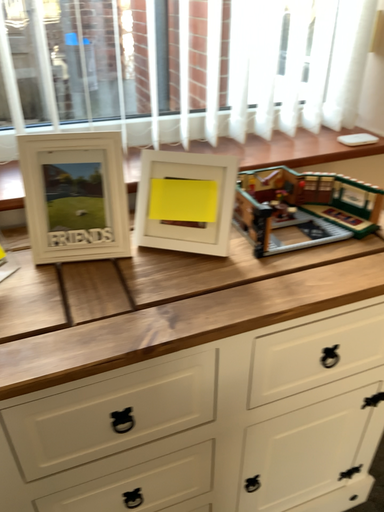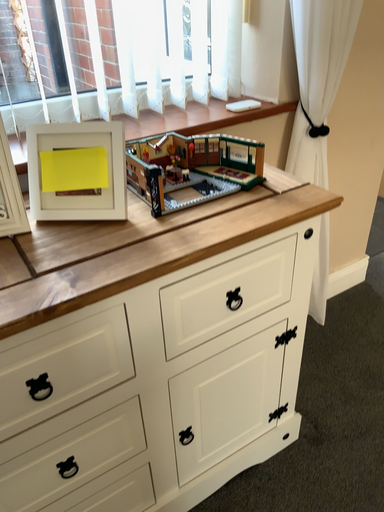
Question: Which way did the camera rotate in the video?

Choices:
 (A) rotated left
 (B) rotated right

Answer: (B)